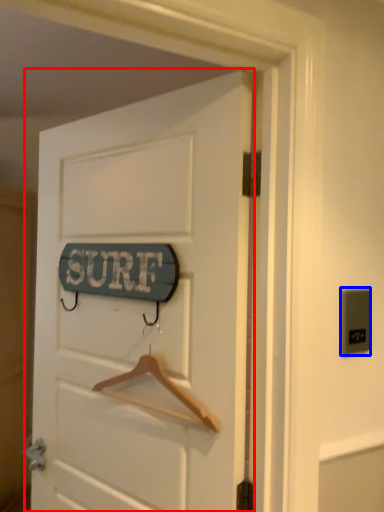
Question: Among these objects, which one is nearest to the camera, door (highlighted by a red box) or electric outlet (highlighted by a blue box)?

Choices:
 (A) door
 (B) electric outlet

Answer: (A)